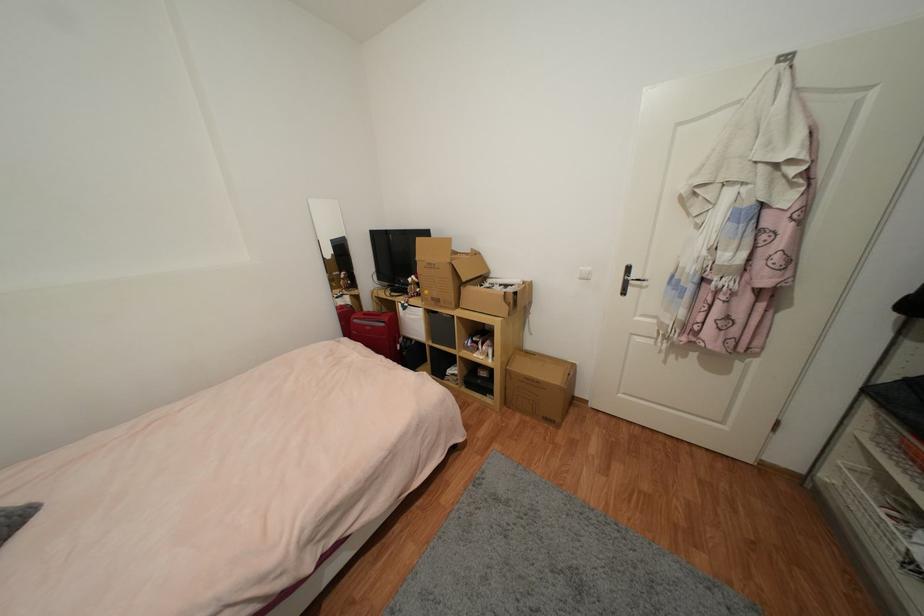
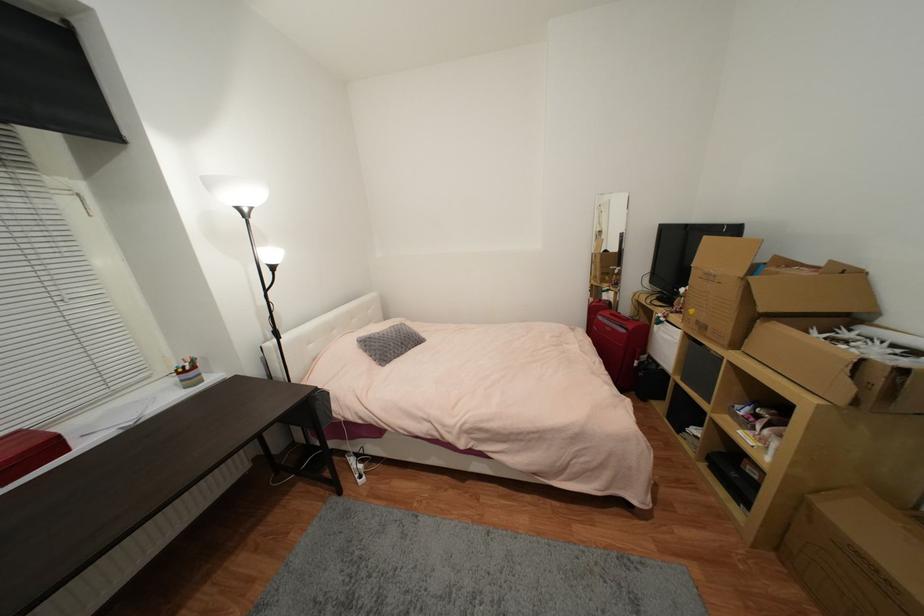
Locate, in the second image, the point that corresponds to point (408, 339) in the first image.

(653, 359)